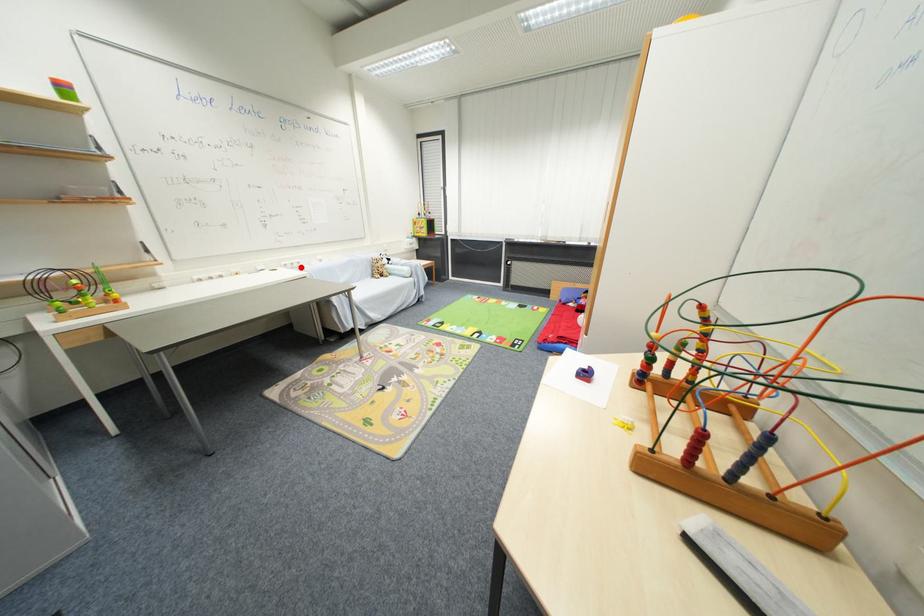
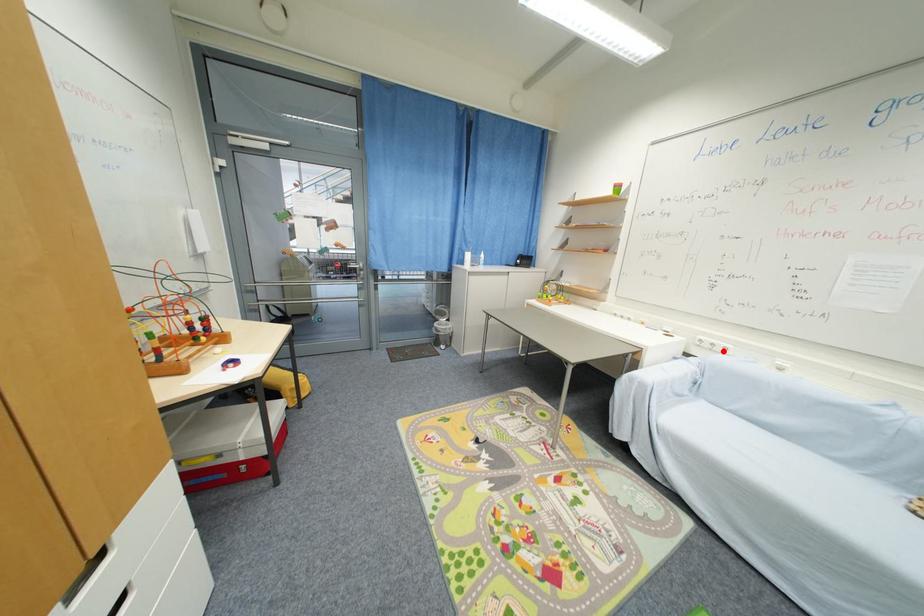
I am providing you with two images of the same scene from different viewpoints. A red point is marked on the first image and another point is marked on the second image. Is the red point in image1 aligned with the point shown in image2?

Yes